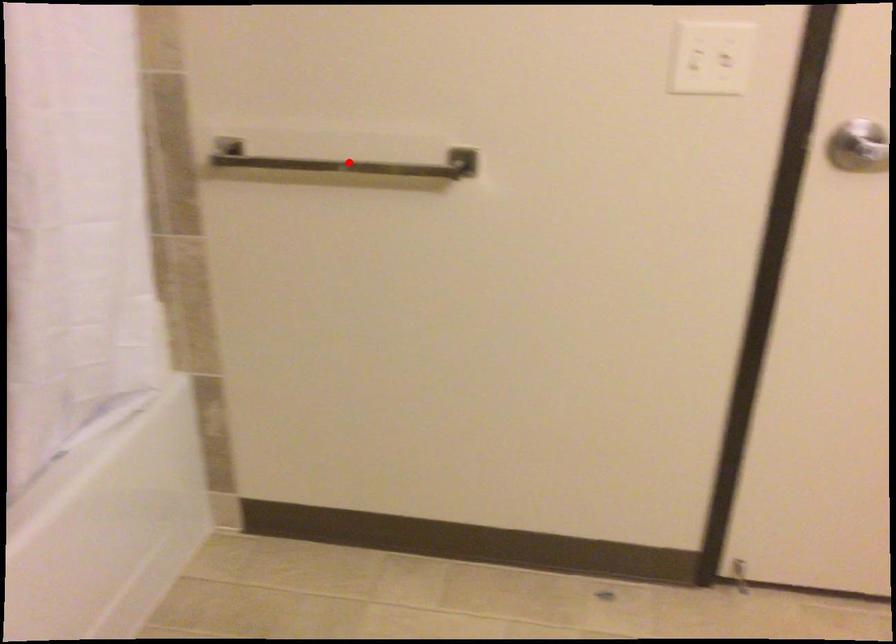
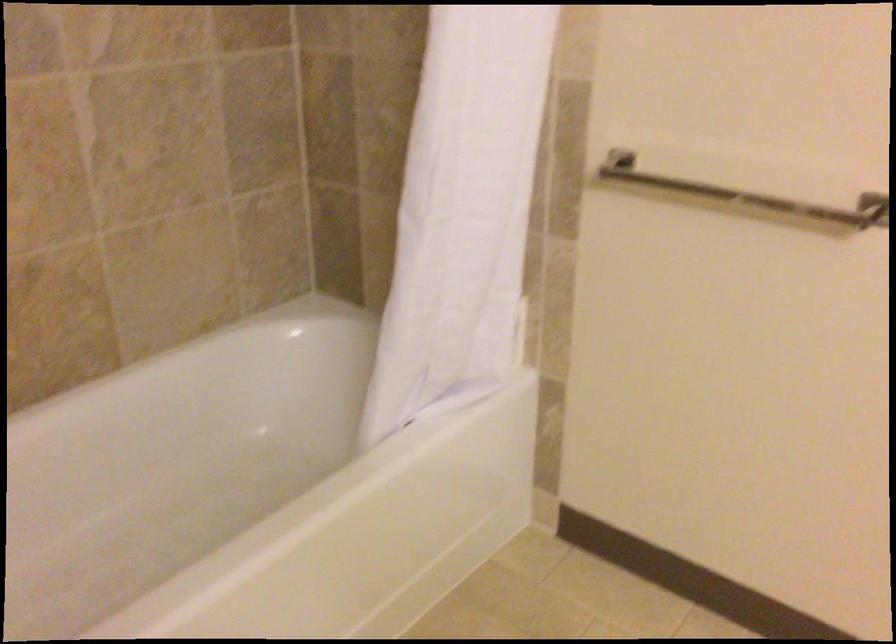
Where in the second image is the point corresponding to the highlighted location from the first image?

(745, 194)